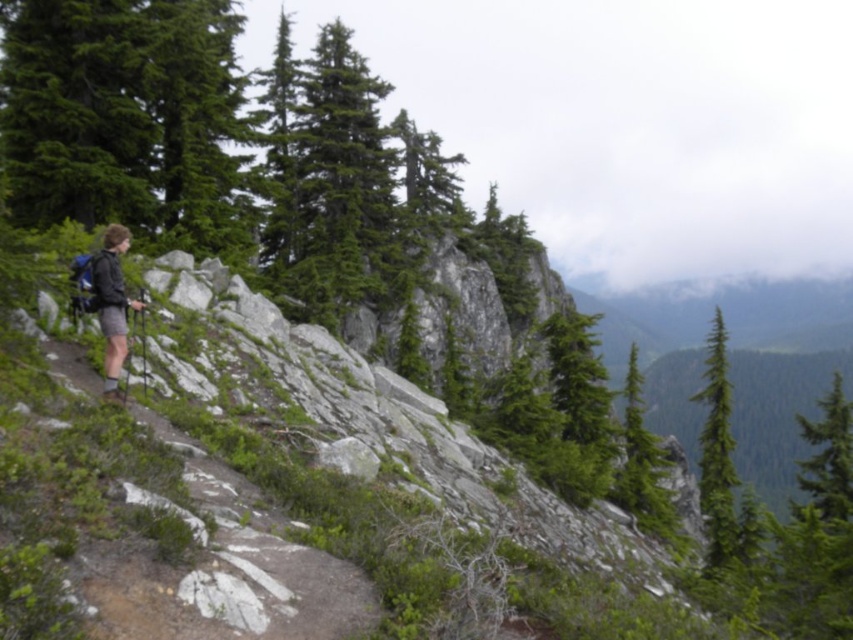
Question: Can you confirm if green matte tree at right is bigger than matte black backpack at left?

Choices:
 (A) no
 (B) yes

Answer: (B)

Question: Which point is closer to the camera?

Choices:
 (A) matte black backpack at left
 (B) green matte tree at right

Answer: (A)

Question: Can you confirm if green matte tree at right is positioned above matte black backpack at left?

Choices:
 (A) no
 (B) yes

Answer: (A)

Question: Which point is closer to the camera taking this photo?

Choices:
 (A) (126, 304)
 (B) (709, 483)

Answer: (A)

Question: Is green matte tree at right to the left of matte black backpack at left from the viewer's perspective?

Choices:
 (A) no
 (B) yes

Answer: (A)